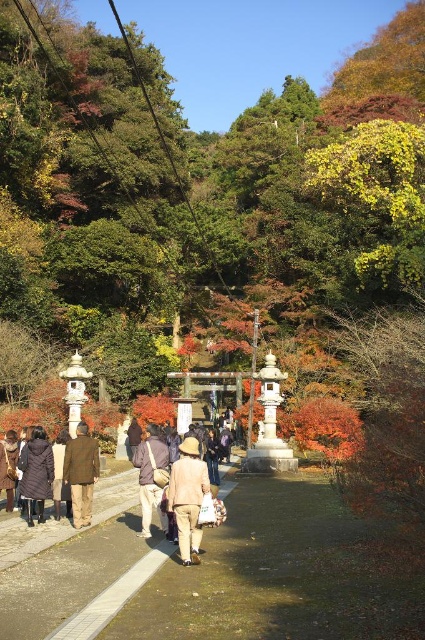
You are standing at the entrance of the shrine and want to walk straight ahead along the path. According to the image, where exactly is the smooth concrete pavement at center located?

The smooth concrete pavement at center is located at point 0.911 on the x axis and 0.184 on the y axis.